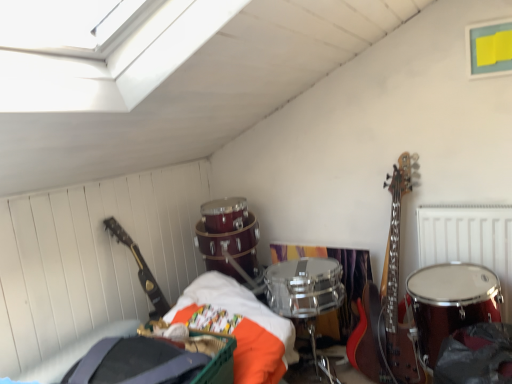
Question: Would you say shiny red drum at right is inside or outside glossy black guitar at left?

Choices:
 (A) inside
 (B) outside

Answer: (B)

Question: Based on their positions, is shiny red drum at right located to the left or right of glossy black guitar at left?

Choices:
 (A) left
 (B) right

Answer: (B)

Question: Estimate the real-world distances between objects in this image. Which object is farther from the shiny red drum at right?

Choices:
 (A) metallic silver radiator at upper right
 (B) glossy black guitar at left

Answer: (B)

Question: Which object is the farthest from the metallic silver radiator at upper right?

Choices:
 (A) glossy black guitar at left
 (B) shiny red drum at right

Answer: (A)